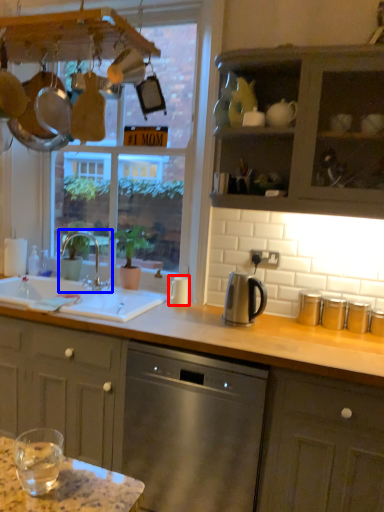
Question: Which point is closer to the camera, appliance (highlighted by a red box) or tap (highlighted by a blue box)?

Choices:
 (A) appliance
 (B) tap

Answer: (A)